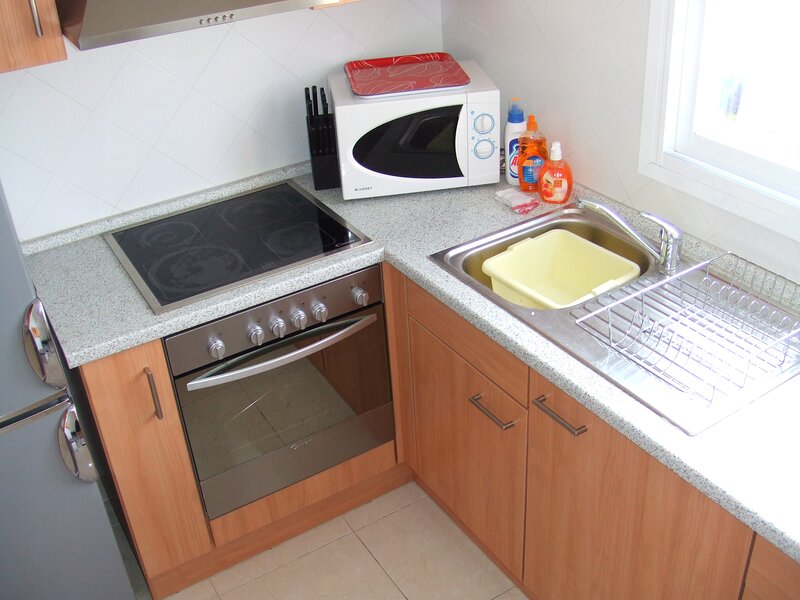
Pinpoint the coordinates of where to open oven in the image. Your answer should be formatted as a list of tuples, i.e. [(x1, y1), (x2, y2), ...], where each tuple contains the x and y coordinates of a point satisfying the conditions above.

[(298, 356)]